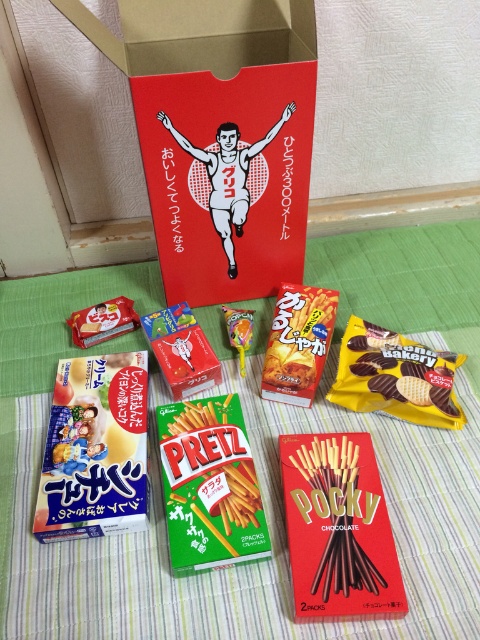
Question: Based on their relative distances, which object is nearer to the green matte pretzels at center?

Choices:
 (A) blue cardboard box at lower left
 (B) yellow chocolate wafer at center
 (C) red matte cardboard box at upper center

Answer: (A)

Question: Is matte orange candy at center positioned before matte plastic candy at center-left?

Choices:
 (A) yes
 (B) no

Answer: (A)

Question: Based on their relative distances, which object is farther from the yellow chocolate wafer at center?

Choices:
 (A) green matte pretzels at center
 (B) matte plastic candy at center-left
 (C) red matte cardboard box at upper center
 (D) chocolate-coated sticks at center

Answer: (B)

Question: Is red matte cardboard box at upper center below chocolate-coated sticks at center?

Choices:
 (A) yes
 (B) no

Answer: (B)

Question: Can you confirm if red matte cardboard box at upper center is positioned to the left of chocolate-coated sticks at center?

Choices:
 (A) no
 (B) yes

Answer: (B)

Question: Which of the following is the closest to the observer?

Choices:
 (A) chocolate-coated sticks at center
 (B) red matte cardboard box at upper center

Answer: (A)